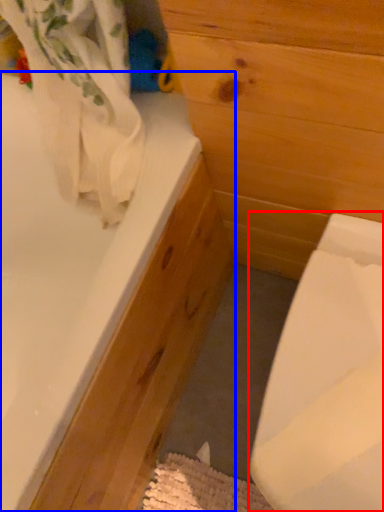
Question: Which object is closer to the camera taking this photo, sink (highlighted by a red box) or bathtub (highlighted by a blue box)?

Choices:
 (A) sink
 (B) bathtub

Answer: (B)